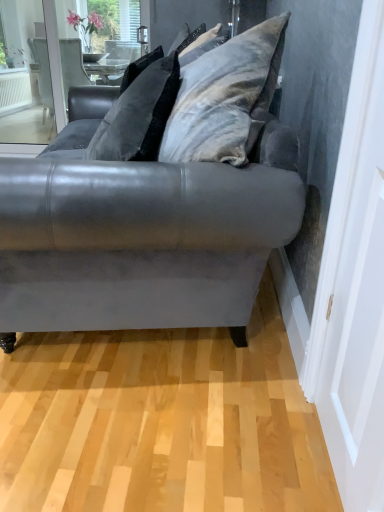
Question: From the image's perspective, would you say matte gray screen door at right is positioned over velvet gray couch at center?

Choices:
 (A) yes
 (B) no

Answer: (B)

Question: Does matte gray screen door at right have a lesser height compared to velvet gray couch at center?

Choices:
 (A) yes
 (B) no

Answer: (B)

Question: Is matte gray screen door at right outside velvet gray couch at center?

Choices:
 (A) yes
 (B) no

Answer: (A)

Question: Can you confirm if matte gray screen door at right is thinner than velvet gray couch at center?

Choices:
 (A) no
 (B) yes

Answer: (B)

Question: From the image's perspective, is matte gray screen door at right under velvet gray couch at center?

Choices:
 (A) yes
 (B) no

Answer: (A)

Question: From a real-world perspective, is velvet gray couch at center positioned above or below velvet gray pillow at upper center?

Choices:
 (A) below
 (B) above

Answer: (A)

Question: Is velvet gray couch at center taller or shorter than velvet gray pillow at upper center?

Choices:
 (A) tall
 (B) short

Answer: (A)

Question: Is velvet gray couch at center in front of or behind velvet gray pillow at upper center in the image?

Choices:
 (A) behind
 (B) front

Answer: (B)

Question: Considering the positions of velvet gray couch at center and velvet gray pillow at upper center in the image, is velvet gray couch at center wider or thinner than velvet gray pillow at upper center?

Choices:
 (A) thin
 (B) wide

Answer: (B)

Question: From the image's perspective, is velvet gray pillow at upper center positioned above or below matte gray screen door at right?

Choices:
 (A) above
 (B) below

Answer: (A)

Question: Based on their sizes in the image, would you say velvet gray pillow at upper center is bigger or smaller than matte gray screen door at right?

Choices:
 (A) big
 (B) small

Answer: (A)

Question: Is velvet gray pillow at upper center taller or shorter than matte gray screen door at right?

Choices:
 (A) tall
 (B) short

Answer: (B)

Question: Would you say velvet gray pillow at upper center is inside or outside matte gray screen door at right?

Choices:
 (A) inside
 (B) outside

Answer: (B)

Question: Is point (119, 92) positioned closer to the camera than point (153, 230)?

Choices:
 (A) closer
 (B) farther

Answer: (B)

Question: In the image, is velvet gray pillow at upper center positioned in front of or behind velvet gray couch at center?

Choices:
 (A) behind
 (B) front

Answer: (A)